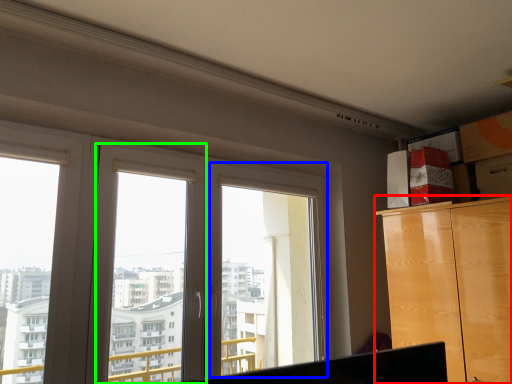
Question: Which is nearer to the cabinetry (highlighted by a red box)? window frame (highlighted by a blue box) or window frame (highlighted by a green box).

Choices:
 (A) window frame
 (B) window frame

Answer: (A)